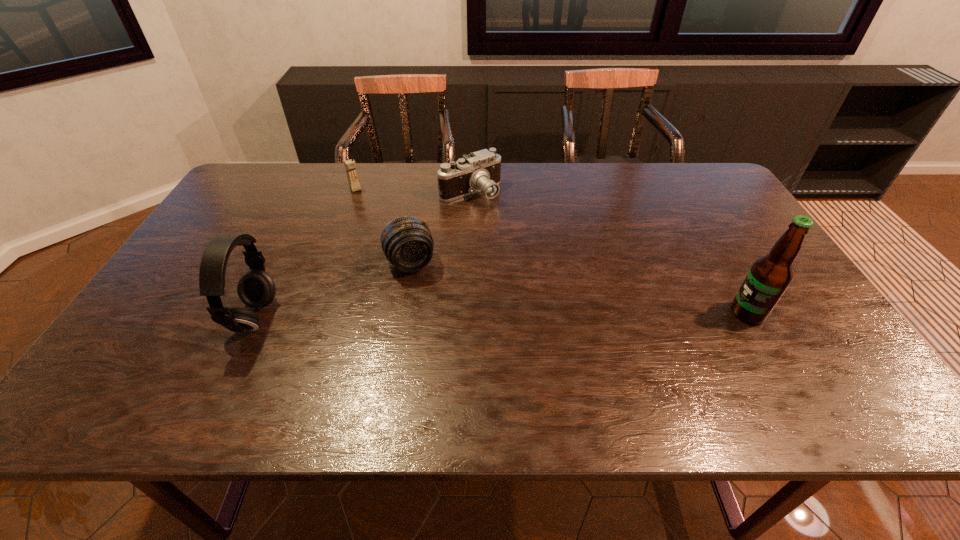
You are a GUI agent. You are given a task and a screenshot of the screen. Output one action in this format:
    pyautogui.click(x=<x>, y=<y>)
    Task: Click on the unoccupied position between the telephoto lens and the earphone
    The image size is (960, 540).
    Given the screenshot: What is the action you would take?
    pyautogui.click(x=333, y=290)

Where is `vacant space in between the third tallest object and the telephoto lens`? The width and height of the screenshot is (960, 540). vacant space in between the third tallest object and the telephoto lens is located at coordinates (383, 226).

Image resolution: width=960 pixels, height=540 pixels. In order to click on empty space between the earphone and the third shortest object in this screenshot , I will do `click(305, 253)`.

The height and width of the screenshot is (540, 960). In order to click on empty space between the third farthest object and the second object from left to right in this screenshot , I will do `click(383, 226)`.

In order to click on object that is the fourth nearest to the camera in this screenshot , I will do `click(769, 277)`.

The width and height of the screenshot is (960, 540). Identify the location of object that stands as the fourth closest to the third farthest object. (769, 277).

Find the location of a particular element. free point that satisfies the following two spatial constraints: 1. on the front side of the third tallest object; 2. on the label of the beer bottle is located at coordinates (310, 313).

At what (x,y) coordinates should I click in order to perform the action: click on free location that satisfies the following two spatial constraints: 1. on the front side of the camera; 2. on the label of the beer bottle. Please return your answer as a coordinate pair (x, y). The width and height of the screenshot is (960, 540). Looking at the image, I should click on (467, 313).